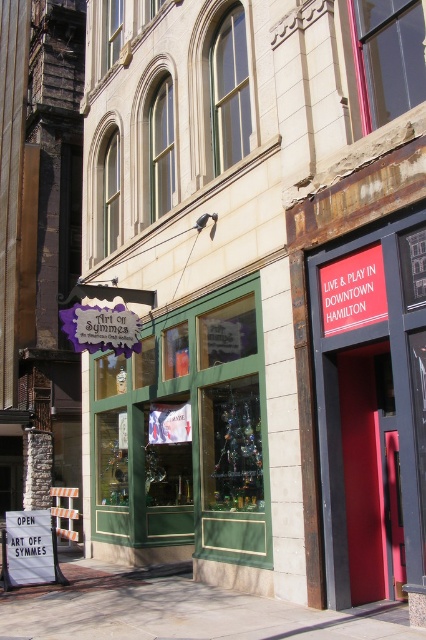
Question: Which object is positioned closest to the red matte door at center?

Choices:
 (A) green glass window at center
 (B) paved stone sidewalk at lower center
 (C) white paper sign at lower left

Answer: (B)

Question: Observing the image, what is the correct spatial positioning of green glass window at center in reference to red matte door at center?

Choices:
 (A) below
 (B) above

Answer: (A)

Question: Estimate the real-world distances between objects in this image. Which object is closer to the green glass window at center?

Choices:
 (A) paved stone sidewalk at lower center
 (B) red matte sign at upper right
 (C) white paper sign at lower left
 (D) red matte door at center

Answer: (C)

Question: Is green glass window at center to the right of red matte sign at upper right from the viewer's perspective?

Choices:
 (A) no
 (B) yes

Answer: (A)

Question: Can you confirm if red matte door at center is positioned below red matte sign at upper right?

Choices:
 (A) no
 (B) yes

Answer: (B)

Question: Which point is closer to the camera taking this photo?

Choices:
 (A) (374, 262)
 (B) (356, 620)

Answer: (B)